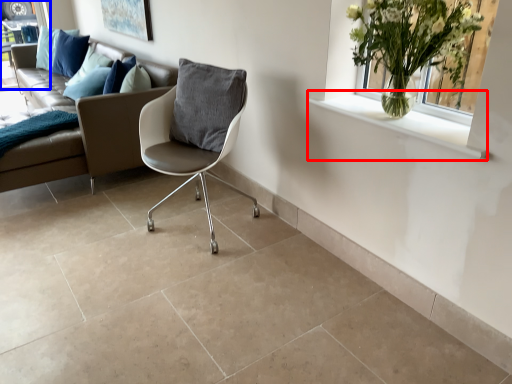
Question: Which object is closer to the camera taking this photo, window sill (highlighted by a red box) or window frame (highlighted by a blue box)?

Choices:
 (A) window sill
 (B) window frame

Answer: (A)